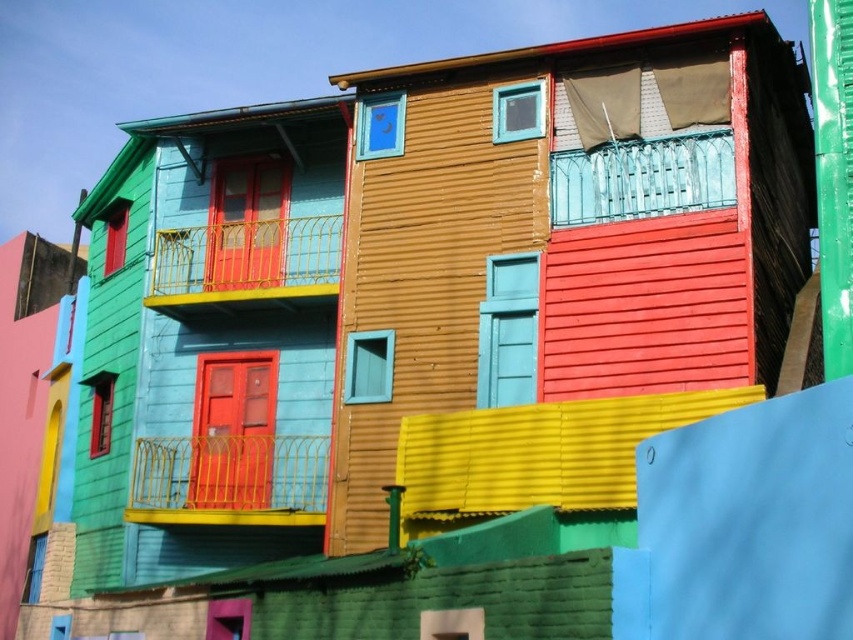
In order to click on yellow metal railing at lower center in this screenshot , I will do `click(229, 480)`.

Is yellow metal railing at lower center shorter than teal glass railing at upper center?

In fact, yellow metal railing at lower center may be taller than teal glass railing at upper center.

Does yellow metal railing at lower center lie behind teal glass railing at upper center?

Yes, yellow metal railing at lower center is behind teal glass railing at upper center.

Does point (233, 515) come farther from viewer compared to point (601, 154)?

Yes, point (233, 515) is behind point (601, 154).

This screenshot has width=853, height=640. I want to click on yellow metal railing at lower center, so click(229, 480).

Based on the photo, between yellow metal railing at upper center and teal glass railing at upper center, which one is positioned higher?

teal glass railing at upper center is above.

Is yellow metal railing at upper center shorter than teal glass railing at upper center?

No, yellow metal railing at upper center is not shorter than teal glass railing at upper center.

The image size is (853, 640). Find the location of `yellow metal railing at upper center`. yellow metal railing at upper center is located at coordinates 244,264.

At what (x,y) coordinates should I click in order to perform the action: click on yellow metal railing at upper center. Please return your answer as a coordinate pair (x, y). This screenshot has height=640, width=853. Looking at the image, I should click on (244, 264).